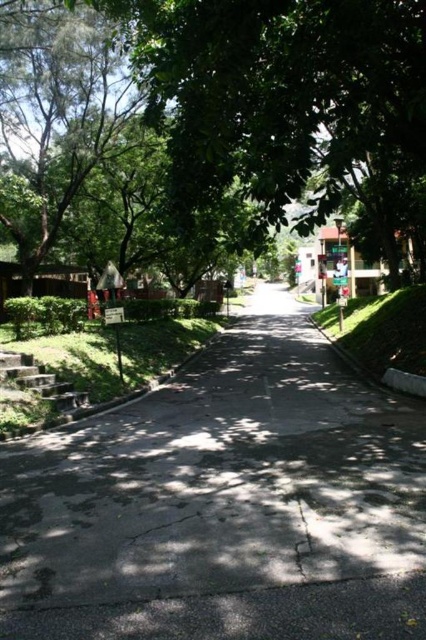
Question: Considering the relative positions of gray concrete pavement at lower left and green leafy tree at upper left in the image provided, where is gray concrete pavement at lower left located with respect to green leafy tree at upper left?

Choices:
 (A) above
 (B) below

Answer: (B)

Question: Is gray concrete pavement at lower left below green leafy tree at upper left?

Choices:
 (A) no
 (B) yes

Answer: (B)

Question: Can you confirm if gray concrete pavement at lower left is positioned below green leafy tree at upper left?

Choices:
 (A) no
 (B) yes

Answer: (B)

Question: Which object appears closest to the camera in this image?

Choices:
 (A) gray concrete pavement at lower left
 (B) green leafy tree at upper left

Answer: (A)